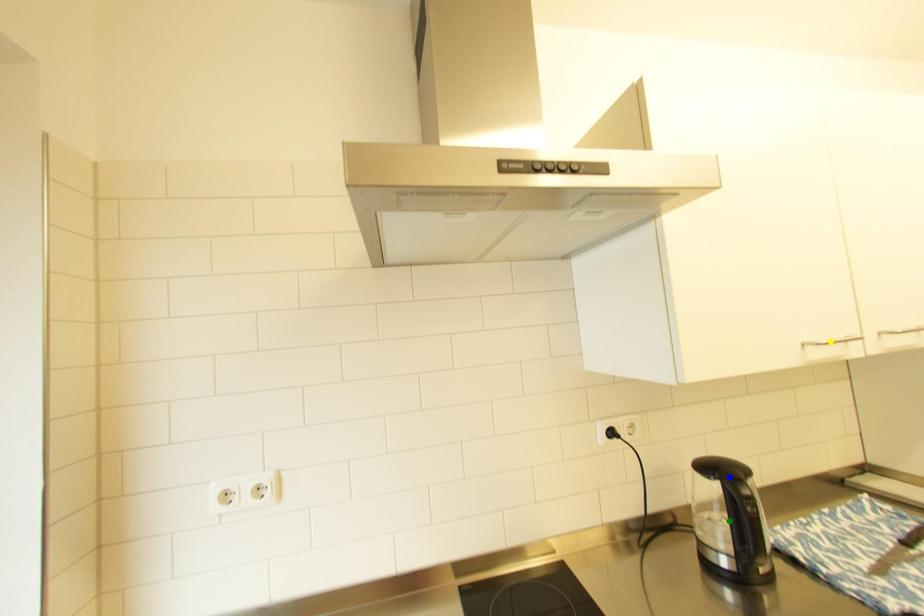
Order these from farthest to nearest:
yellow point
blue point
green point

1. green point
2. blue point
3. yellow point